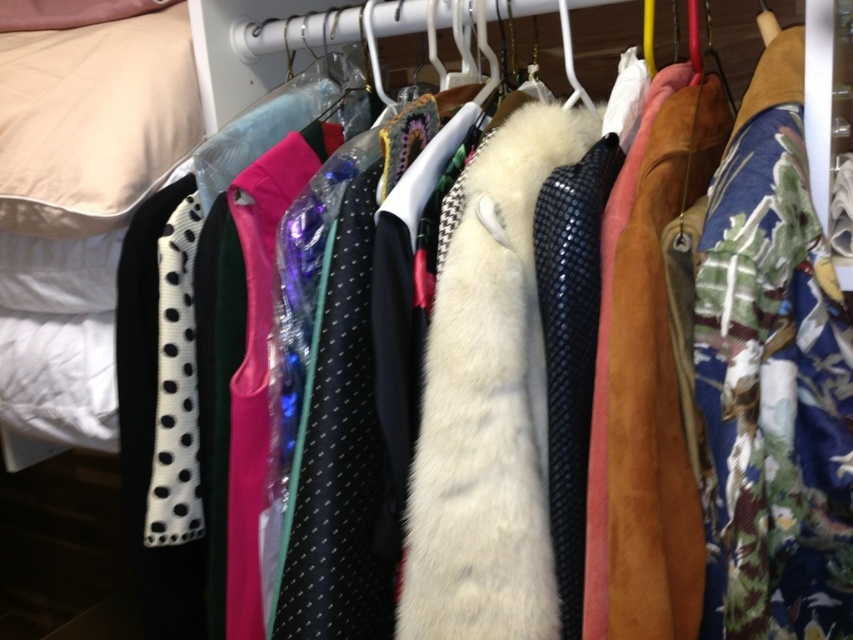
Question: Which is nearer to the floral fabric dress at right?

Choices:
 (A) white fabric pillow at upper left
 (B) black textured tie at center
 (C) black dotted fabric tie at left

Answer: (B)

Question: Is black dotted fabric tie at center to the left of black textured tie at center from the viewer's perspective?

Choices:
 (A) no
 (B) yes

Answer: (B)

Question: Which point is closer to the camera?

Choices:
 (A) black textured tie at center
 (B) white fur coat at center

Answer: (B)

Question: Can you confirm if floral fabric dress at right is thinner than white fur coat at center?

Choices:
 (A) no
 (B) yes

Answer: (B)

Question: Which is farther from the black textured tie at center?

Choices:
 (A) black dotted fabric tie at left
 (B) black dotted fabric tie at center
 (C) white fur coat at center

Answer: (A)

Question: Does black dotted fabric tie at center appear under black dotted fabric tie at left?

Choices:
 (A) no
 (B) yes

Answer: (B)